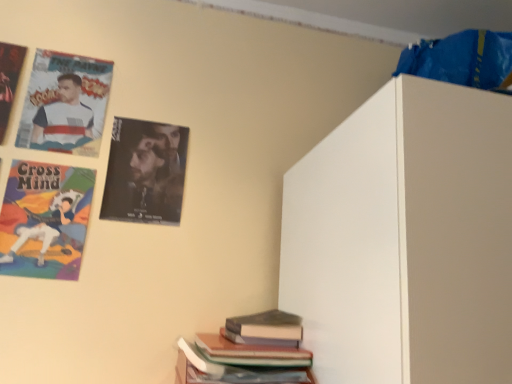
Question: Would you say cartoon character poster at upper left contains matte paper poster at upper left, which is counted as the second poster, starting from the right?

Choices:
 (A) no
 (B) yes

Answer: (A)

Question: Are cartoon character poster at upper left and matte paper poster at upper left, the second poster when ordered from left to right, beside each other?

Choices:
 (A) no
 (B) yes

Answer: (A)

Question: Is cartoon character poster at upper left behind matte paper poster at upper left, the second poster when ordered from left to right?

Choices:
 (A) no
 (B) yes

Answer: (A)

Question: Does cartoon character poster at upper left appear on the left side of matte paper poster at upper left, which is counted as the second poster, starting from the right?

Choices:
 (A) no
 (B) yes

Answer: (B)

Question: Considering the relative sizes of cartoon character poster at upper left and matte paper poster at upper left, the second poster when ordered from left to right, in the image provided, is cartoon character poster at upper left bigger than matte paper poster at upper left, the second poster when ordered from left to right,?

Choices:
 (A) yes
 (B) no

Answer: (B)

Question: Is hardcover book at lower center, marked as the first book in a bottom-to-top arrangement, taller or shorter than cartoon character poster at upper left?

Choices:
 (A) short
 (B) tall

Answer: (A)

Question: Is hardcover book at lower center, marked as the first book in a bottom-to-top arrangement, wider or thinner than cartoon character poster at upper left?

Choices:
 (A) wide
 (B) thin

Answer: (A)

Question: Looking at the image, does hardcover book at lower center, the 2th book viewed from the top, seem bigger or smaller compared to cartoon character poster at upper left?

Choices:
 (A) big
 (B) small

Answer: (A)

Question: In the image, is hardcover book at lower center, marked as the first book in a bottom-to-top arrangement, on the left side or the right side of cartoon character poster at upper left?

Choices:
 (A) left
 (B) right

Answer: (B)

Question: In terms of height, does hardcover book at lower right, placed as the 2th book when sorted from bottom to top, look taller or shorter compared to hardcover book at lower center, marked as the first book in a bottom-to-top arrangement?

Choices:
 (A) tall
 (B) short

Answer: (B)

Question: Would you say hardcover book at lower right, placed as the 2th book when sorted from bottom to top, is to the left or to the right of hardcover book at lower center, marked as the first book in a bottom-to-top arrangement, in the picture?

Choices:
 (A) left
 (B) right

Answer: (B)

Question: From the image's perspective, is hardcover book at lower right, the 1th book in the top-to-bottom sequence, located above or below hardcover book at lower center, the 2th book viewed from the top?

Choices:
 (A) below
 (B) above

Answer: (B)

Question: Looking at their shapes, would you say hardcover book at lower right, the 1th book in the top-to-bottom sequence, is wider or thinner than hardcover book at lower center, marked as the first book in a bottom-to-top arrangement?

Choices:
 (A) wide
 (B) thin

Answer: (B)

Question: Is point (263, 319) closer or farther from the camera than point (91, 89)?

Choices:
 (A) farther
 (B) closer

Answer: (B)

Question: Choose the correct answer: Is hardcover book at lower right, placed as the 2th book when sorted from bottom to top, inside matte paper poster at upper left, which is counted as the second poster, starting from the right, or outside it?

Choices:
 (A) inside
 (B) outside

Answer: (B)